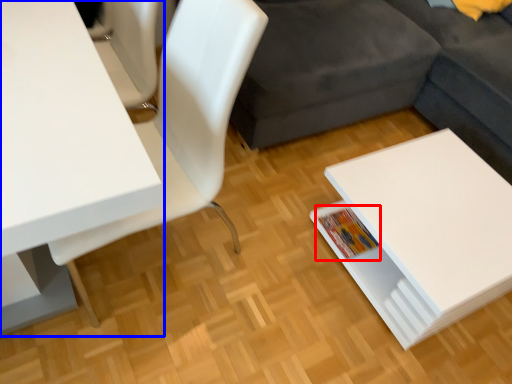
Question: Among these objects, which one is nearest to the camera, book (highlighted by a red box) or table (highlighted by a blue box)?

Choices:
 (A) book
 (B) table

Answer: (B)